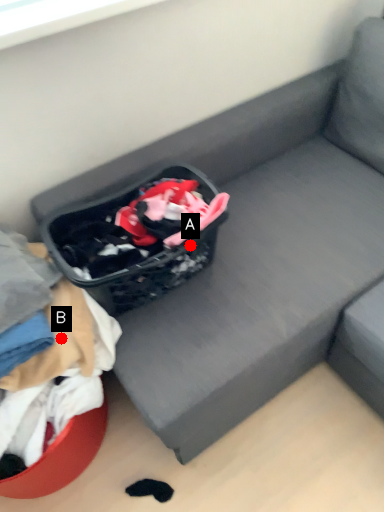
Question: Two points are circled on the image, labeled by A and B beside each circle. Which point appears closest to the camera in this image?

Choices:
 (A) A is closer
 (B) B is closer

Answer: (B)